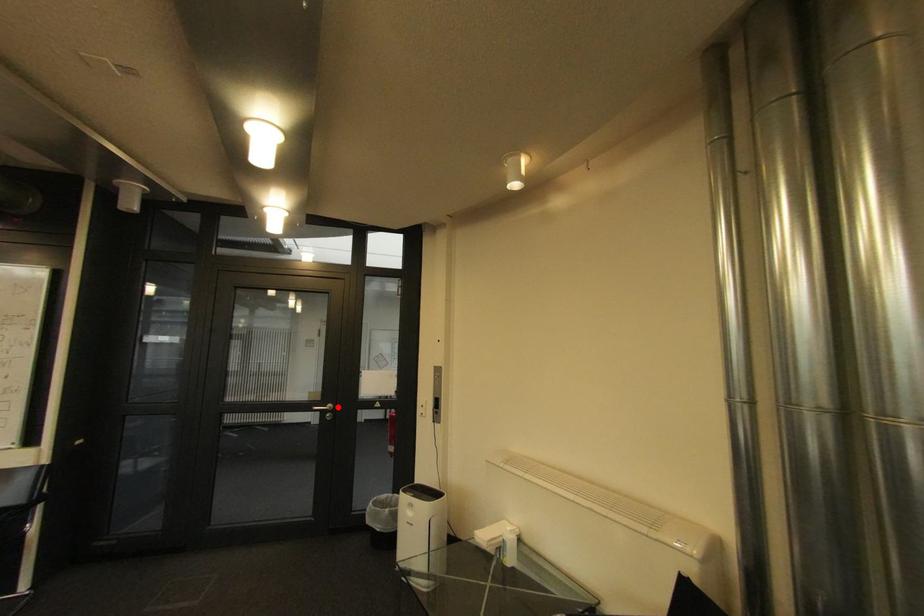
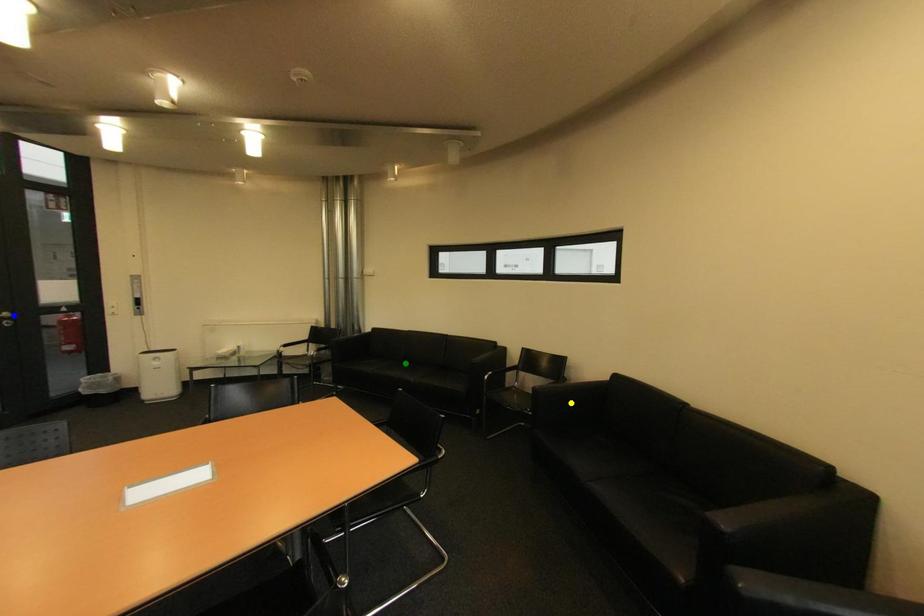
Question: I am providing you with two images of the same scene from different viewpoints. A red point is marked on the first image. You are given multiple points on the second image. Can you choose the point in image 2 that corresponds to the point in image 1?

Choices:
 (A) green point
 (B) blue point
 (C) yellow point

Answer: (B)